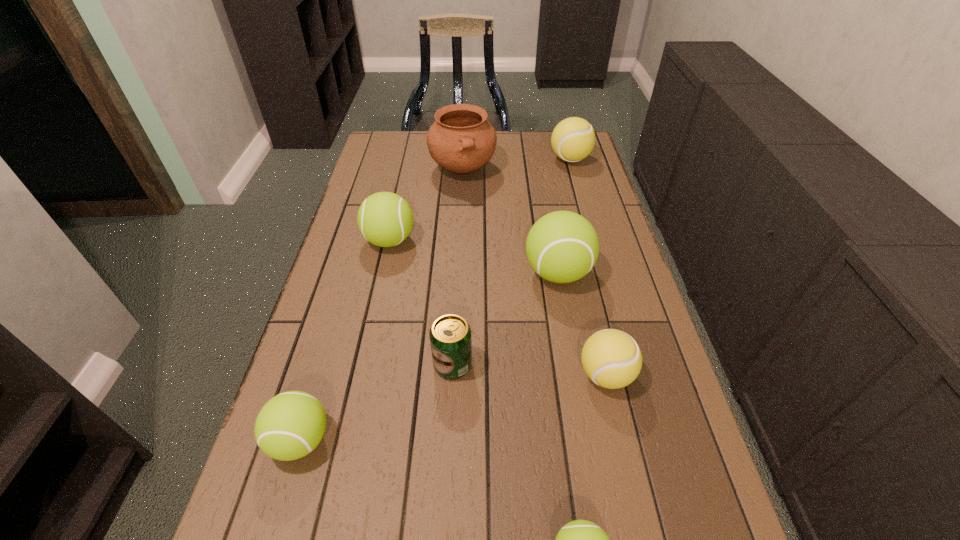
Where is `pottery`? Image resolution: width=960 pixels, height=540 pixels. pottery is located at coordinates (461, 140).

This screenshot has height=540, width=960. Identify the location of the tallest tennis ball. [x=562, y=246].

Locate an element on the screen. This screenshot has height=540, width=960. the second biggest green tennis ball is located at coordinates 385,219.

Identify the location of the farthest tennis ball. (573, 139).

Find the location of `the farther yellow tennis ball`. the farther yellow tennis ball is located at coordinates (573, 139).

The image size is (960, 540). I want to click on beer can, so click(x=450, y=335).

Where is `the smaller yellow tennis ball`? The width and height of the screenshot is (960, 540). the smaller yellow tennis ball is located at coordinates (612, 359).

Image resolution: width=960 pixels, height=540 pixels. Find the location of `the nearer yellow tennis ball`. the nearer yellow tennis ball is located at coordinates (612, 359).

The width and height of the screenshot is (960, 540). In order to click on the fifth farthest tennis ball in this screenshot , I will do `click(290, 425)`.

You are a GUI agent. You are given a task and a screenshot of the screen. Output one action in this format:
    pyautogui.click(x=<x>, y=<y>)
    Task: Click on the second nearest object
    
    Given the screenshot: What is the action you would take?
    pyautogui.click(x=290, y=425)